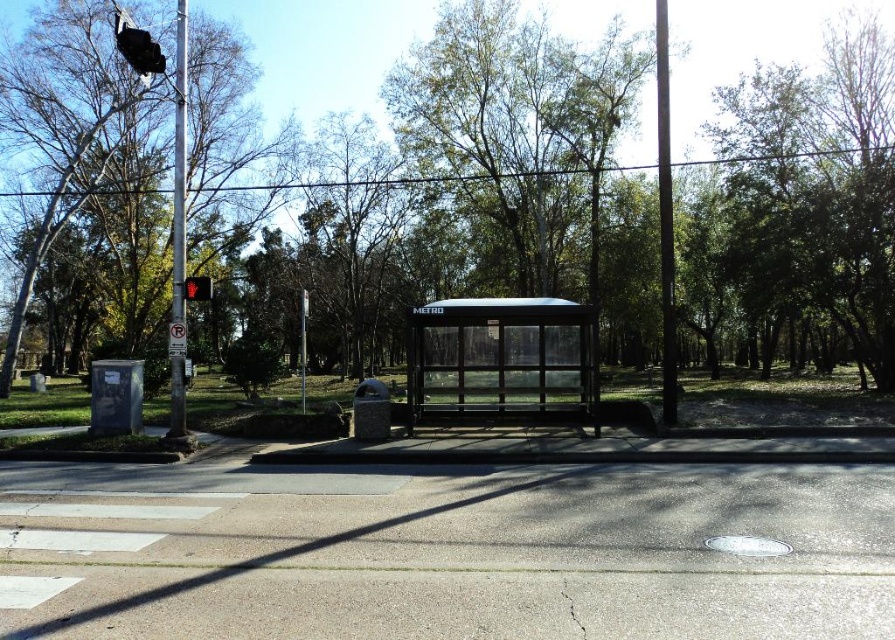
You are standing at the bus stop labeled METRO and want to reach a point that is exactly 50 feet away from your current position. Can you determine if the point at coordinates point [471,304] is within your target distance?

The point [471,304] is 50.93 feet from the viewer, which is slightly beyond the 50 feet target distance. Therefore, it is not within the desired range.

You are standing at the bus stop labeled METRO and want to locate the black plastic traffic light at upper left. According to the coordinates given, where exactly should you look?

The black plastic traffic light at upper left is located at coordinates point (137, 48).

You are a delivery person trying to avoid getting your packages wet during a sudden rain. You see the silver metallic pole at left and the red glass traffic light at upper left. Which object can provide better shelter from the rain?

The silver metallic pole at left is much taller than the red glass traffic light at upper left, so it can provide better shelter from the rain.